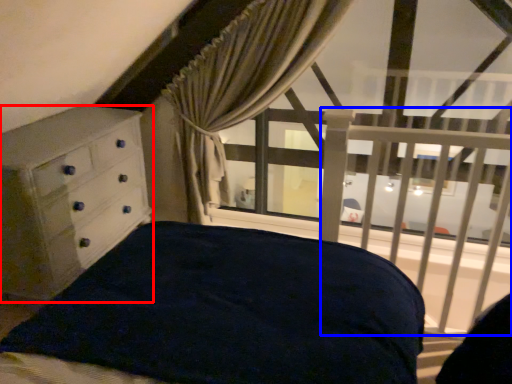
Question: Which point is further to the camera, chest of drawers (highlighted by a red box) or balustrade (highlighted by a blue box)?

Choices:
 (A) chest of drawers
 (B) balustrade

Answer: (A)